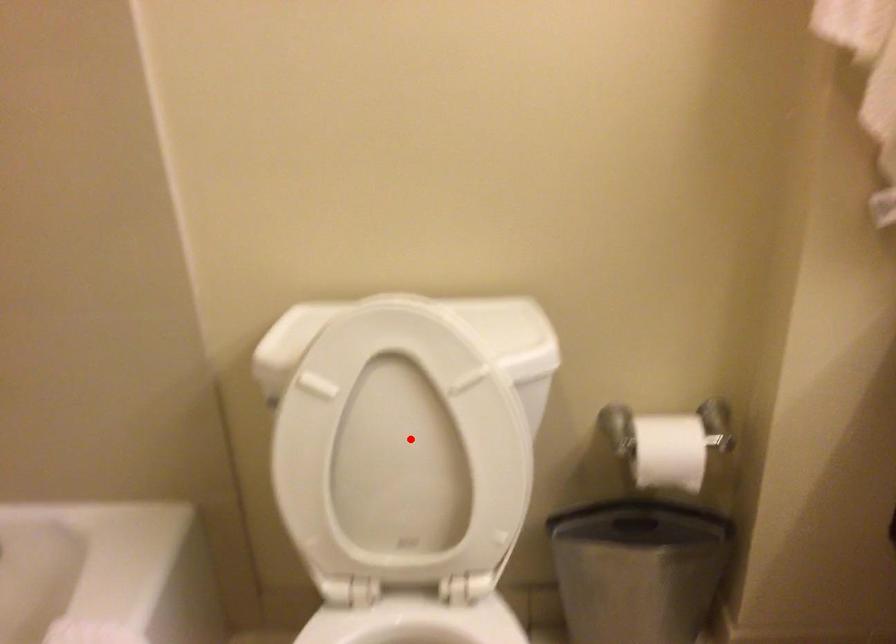
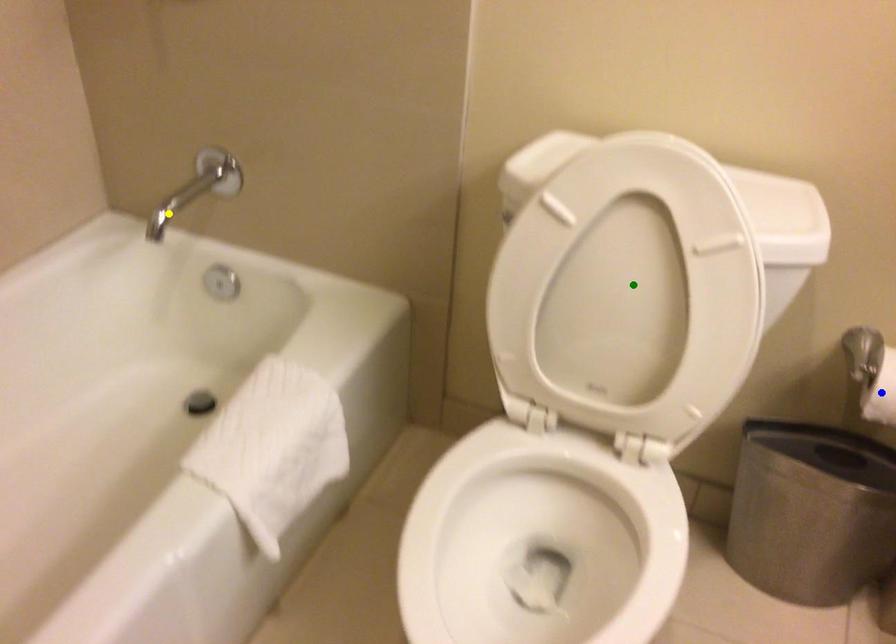
Question: I am providing you with two images of the same scene from different viewpoints. A red point is marked on the first image. You are given multiple points on the second image. Which point in image 2 represents the same 3d spot as the red point in image 1?

Choices:
 (A) blue point
 (B) green point
 (C) yellow point

Answer: (B)